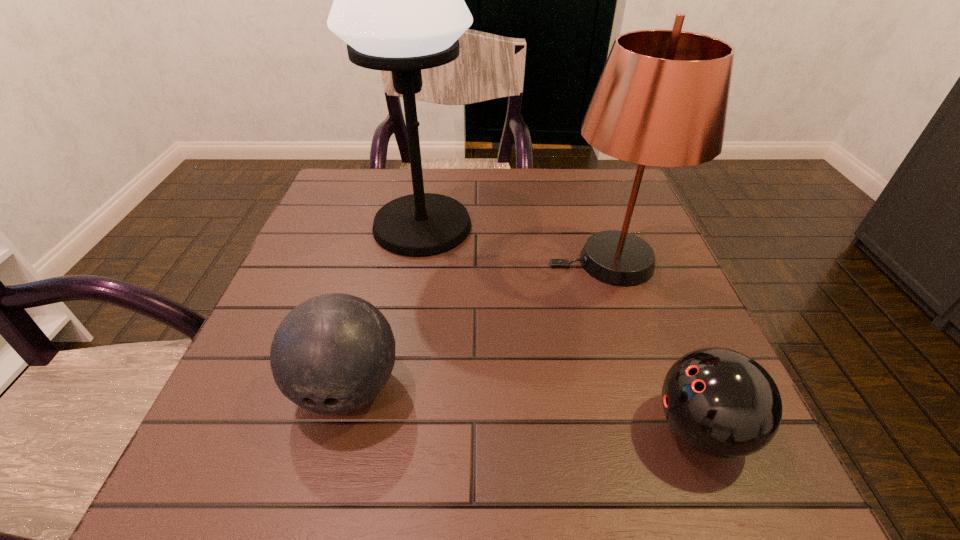
Where is `the tallest object`? The image size is (960, 540). the tallest object is located at coordinates (399, 5).

You are a GUI agent. You are given a task and a screenshot of the screen. Output one action in this format:
    pyautogui.click(x=<x>, y=<y>)
    Task: Click on the lampshade
    The height and width of the screenshot is (540, 960).
    Given the screenshot: What is the action you would take?
    pyautogui.click(x=662, y=98)

At what (x,y) coordinates should I click in order to perform the action: click on the left bowling ball. Please return your answer as a coordinate pair (x, y). The image size is (960, 540). Looking at the image, I should click on (332, 354).

Where is `the third tallest object`? the third tallest object is located at coordinates (332, 354).

I want to click on the shorter bowling ball, so click(719, 401).

The width and height of the screenshot is (960, 540). Identify the location of the right bowling ball. (719, 401).

At what (x,y) coordinates should I click in order to perform the action: click on vacant space situated 0.100m on the back of the table lamp. Please return your answer as a coordinate pair (x, y). Image resolution: width=960 pixels, height=540 pixels. Looking at the image, I should click on (430, 179).

What are the coordinates of `free region located on the front-facing side of the lampshade` in the screenshot? It's located at (497, 262).

Where is `free space located on the front-facing side of the lampshade`? This screenshot has width=960, height=540. free space located on the front-facing side of the lampshade is located at coordinates (395, 262).

The image size is (960, 540). What are the coordinates of `blank area located on the front-facing side of the lampshade` in the screenshot? It's located at (380, 262).